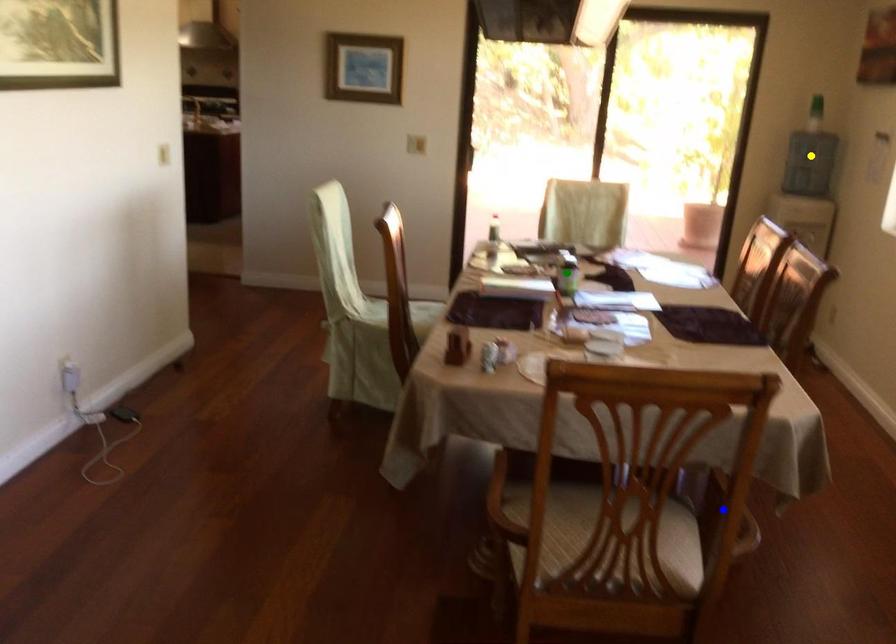
Order these from nearest to farthest:
A) green point
B) blue point
C) yellow point

blue point < green point < yellow point